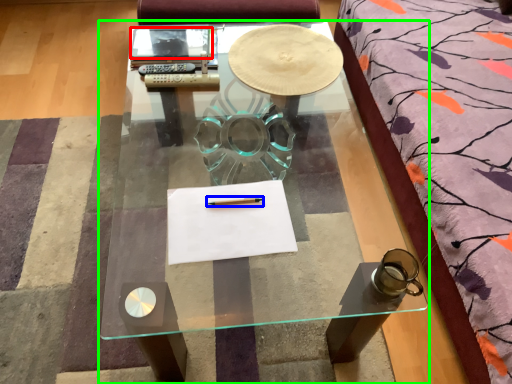
Question: Based on their relative distances, which object is farther from notebook (highlighted by a red box)? Choose from pencil (highlighted by a blue box) and coffee table (highlighted by a green box).

Choices:
 (A) pencil
 (B) coffee table

Answer: (A)